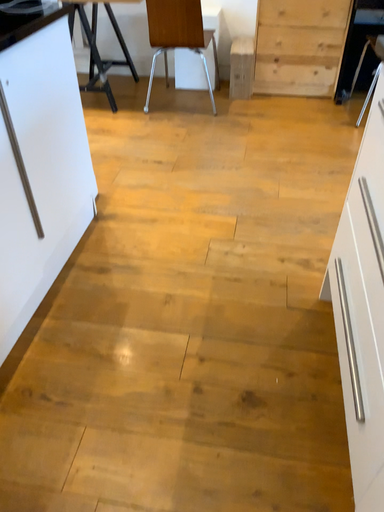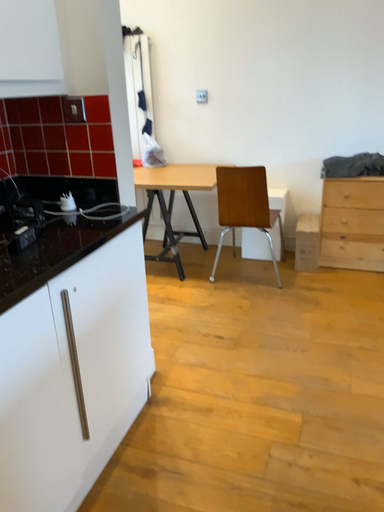
Question: Which way did the camera rotate in the video?

Choices:
 (A) rotated left
 (B) rotated right

Answer: (A)